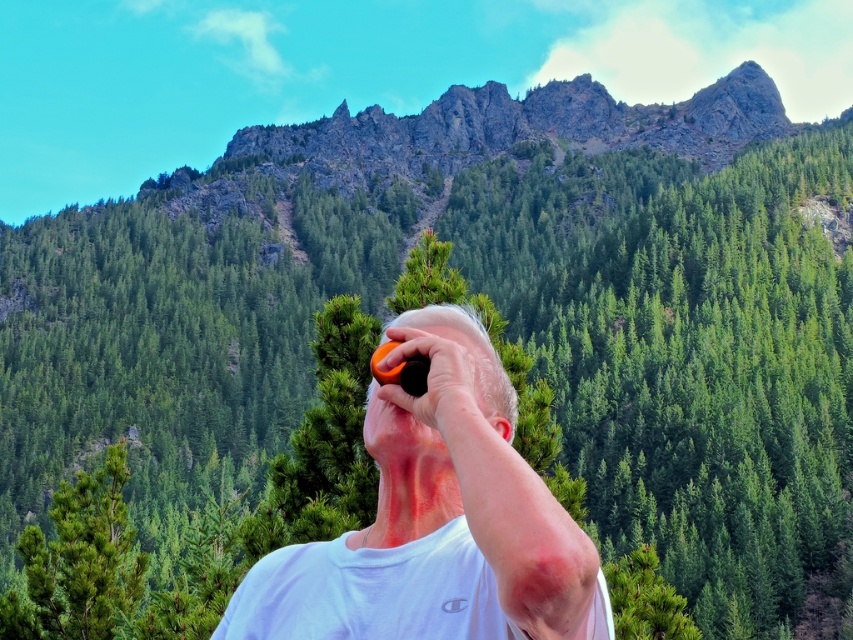
Question: Can you confirm if orange matte camera at center is thinner than orange matte tennis ball at upper center?

Choices:
 (A) yes
 (B) no

Answer: (B)

Question: Can you confirm if orange matte camera at center is positioned above orange matte tennis ball at upper center?

Choices:
 (A) yes
 (B) no

Answer: (B)

Question: Which point is closer to the camera taking this photo?

Choices:
 (A) (397, 348)
 (B) (572, 596)

Answer: (B)

Question: Which point is farther to the camera?

Choices:
 (A) (427, 346)
 (B) (254, 600)

Answer: (B)

Question: Is orange matte camera at center wider than orange matte tennis ball at upper center?

Choices:
 (A) no
 (B) yes

Answer: (B)